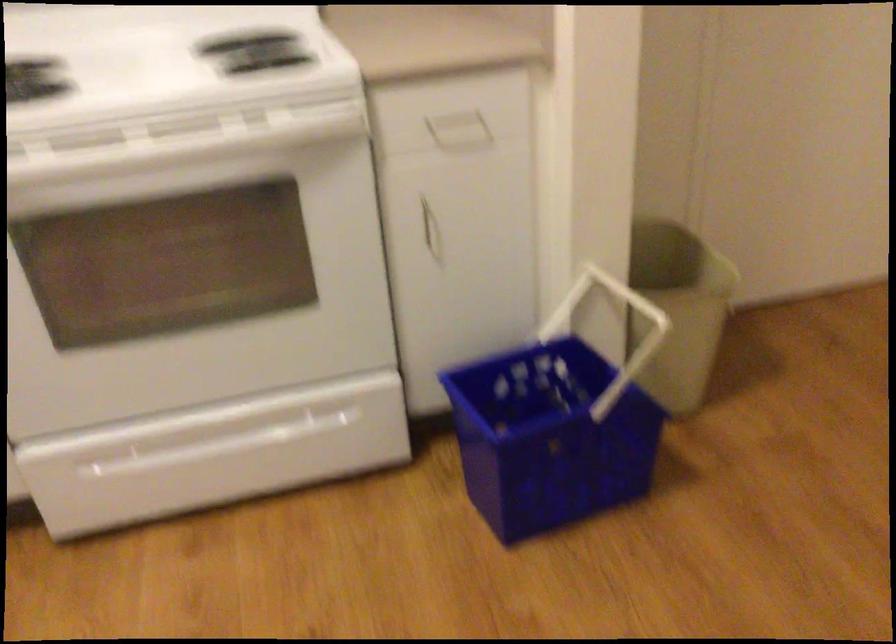
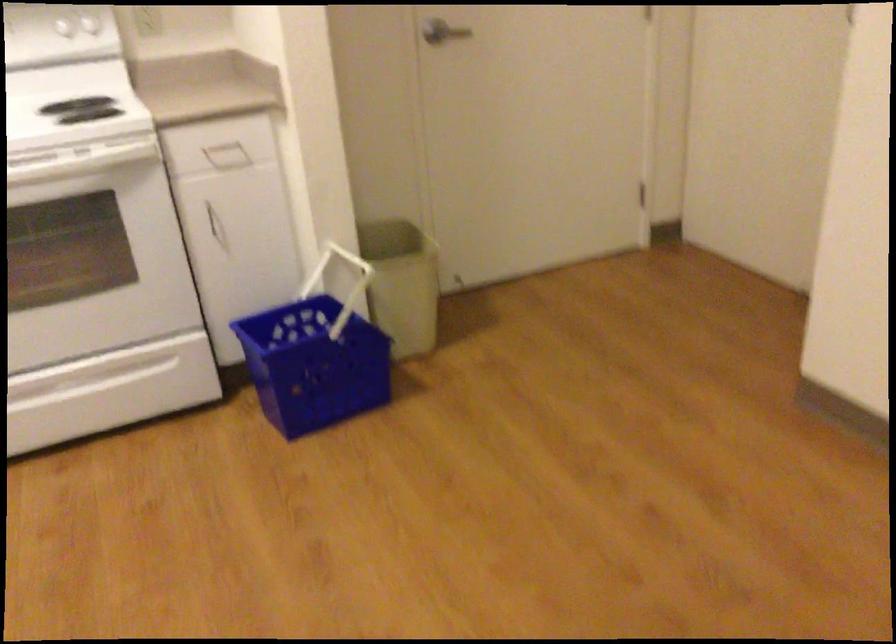
Question: How did the camera likely rotate?

Choices:
 (A) Left
 (B) Right
 (C) Up
 (D) Down

Answer: (B)